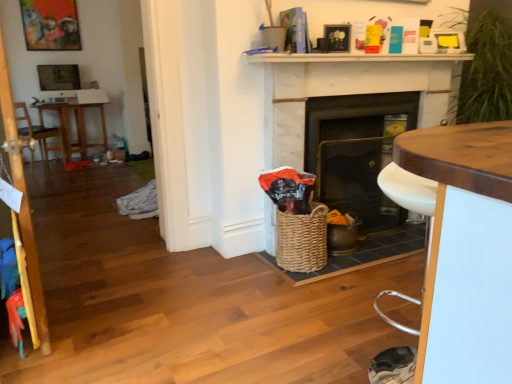
Question: From the image's perspective, is white marble fireplace at upper center below white glossy desk at center?

Choices:
 (A) yes
 (B) no

Answer: (B)

Question: Is white marble fireplace at upper center next to white glossy desk at center?

Choices:
 (A) no
 (B) yes

Answer: (A)

Question: Is white marble fireplace at upper center at the right side of white glossy desk at center?

Choices:
 (A) yes
 (B) no

Answer: (A)

Question: Does white marble fireplace at upper center have a lesser width compared to white glossy desk at center?

Choices:
 (A) yes
 (B) no

Answer: (A)

Question: Does white marble fireplace at upper center turn towards white glossy desk at center?

Choices:
 (A) yes
 (B) no

Answer: (B)

Question: Is white marble fireplace at upper center oriented away from white glossy desk at center?

Choices:
 (A) no
 (B) yes

Answer: (A)

Question: Is matte black fireplace at center, the 1th fireplace positioned from the left, smaller than brown wooden table at left?

Choices:
 (A) no
 (B) yes

Answer: (B)

Question: Is matte black fireplace at center, acting as the 2th fireplace starting from the right, thinner than brown wooden table at left?

Choices:
 (A) yes
 (B) no

Answer: (A)

Question: Does matte black fireplace at center, the 1th fireplace positioned from the left, have a lesser height compared to brown wooden table at left?

Choices:
 (A) no
 (B) yes

Answer: (A)

Question: From a real-world perspective, is matte black fireplace at center, the 1th fireplace positioned from the left, on top of brown wooden table at left?

Choices:
 (A) yes
 (B) no

Answer: (A)

Question: Is matte black fireplace at center, the 1th fireplace positioned from the left, not inside brown wooden table at left?

Choices:
 (A) yes
 (B) no

Answer: (A)

Question: From the image's perspective, is matte black fireplace at center, acting as the 2th fireplace starting from the right, beneath brown wooden table at left?

Choices:
 (A) no
 (B) yes

Answer: (B)

Question: Can you confirm if wooden armchair at left is taller than white marble fireplace at center, positioned as the 2th fireplace in left-to-right order?

Choices:
 (A) no
 (B) yes

Answer: (A)